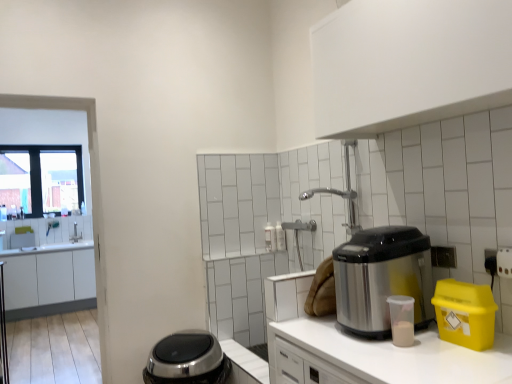
Question: Is white matte countertop at center at the left side of stainless steel appliance at right?

Choices:
 (A) yes
 (B) no

Answer: (A)

Question: Considering the relative positions of white matte countertop at center and stainless steel appliance at right in the image provided, is white matte countertop at center to the right of stainless steel appliance at right from the viewer's perspective?

Choices:
 (A) yes
 (B) no

Answer: (B)

Question: Is white matte countertop at center facing towards stainless steel appliance at right?

Choices:
 (A) yes
 (B) no

Answer: (B)

Question: Is white matte countertop at center completely or partially outside of stainless steel appliance at right?

Choices:
 (A) yes
 (B) no

Answer: (A)

Question: Is white matte countertop at center positioned far away from stainless steel appliance at right?

Choices:
 (A) no
 (B) yes

Answer: (A)

Question: From a real-world perspective, is white matte countertop at center over stainless steel appliance at right?

Choices:
 (A) yes
 (B) no

Answer: (B)

Question: Considering the relative sizes of white matte cabinet at upper center, positioned as the 2th cabinetry in bottom-to-top order, and satin silver appliance at lower center, marked as the 2th appliance in a right-to-left arrangement, in the image provided, is white matte cabinet at upper center, positioned as the 2th cabinetry in bottom-to-top order, taller than satin silver appliance at lower center, marked as the 2th appliance in a right-to-left arrangement,?

Choices:
 (A) no
 (B) yes

Answer: (B)

Question: Can you confirm if white matte cabinet at upper center, the 1th cabinetry from the front, is positioned to the right of satin silver appliance at lower center, marked as the 1th appliance in a left-to-right arrangement?

Choices:
 (A) no
 (B) yes

Answer: (B)

Question: Is white matte cabinet at upper center, the second cabinetry in the left-to-right sequence, not within satin silver appliance at lower center, arranged as the first appliance when viewed from the back?

Choices:
 (A) yes
 (B) no

Answer: (A)

Question: Is white matte cabinet at upper center, positioned as the 2th cabinetry in bottom-to-top order, in front of satin silver appliance at lower center, marked as the 1th appliance in a left-to-right arrangement?

Choices:
 (A) yes
 (B) no

Answer: (A)

Question: From the image's perspective, does white matte cabinet at upper center, placed as the second cabinetry when sorted from back to front, appear lower than satin silver appliance at lower center, arranged as the first appliance when viewed from the back?

Choices:
 (A) no
 (B) yes

Answer: (A)

Question: Considering the relative sizes of white matte cabinet at upper center, arranged as the first cabinetry when viewed from the top, and satin silver appliance at lower center, the 2th appliance from the front, in the image provided, is white matte cabinet at upper center, arranged as the first cabinetry when viewed from the top, shorter than satin silver appliance at lower center, the 2th appliance from the front,?

Choices:
 (A) yes
 (B) no

Answer: (B)

Question: Is stainless steel appliance at right wider than white matte countertop at center?

Choices:
 (A) yes
 (B) no

Answer: (B)